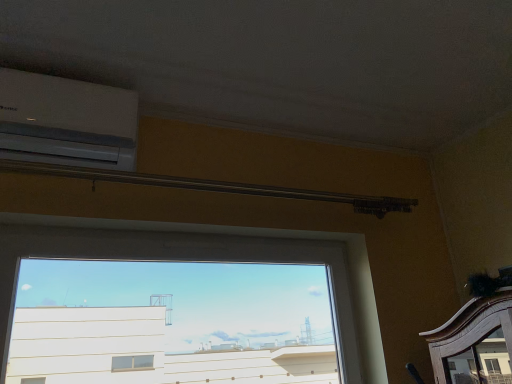
This screenshot has height=384, width=512. What do you see at coordinates (66, 121) in the screenshot? I see `white plastic air conditioner at upper left` at bounding box center [66, 121].

The width and height of the screenshot is (512, 384). I want to click on white plastic air conditioner at upper left, so click(x=66, y=121).

The height and width of the screenshot is (384, 512). I want to click on transparent glass window at center, so [x=215, y=260].

Image resolution: width=512 pixels, height=384 pixels. Describe the element at coordinates (215, 260) in the screenshot. I see `transparent glass window at center` at that location.

The width and height of the screenshot is (512, 384). What are the coordinates of `white plastic air conditioner at upper left` in the screenshot? It's located at (66, 121).

In the scene shown: Considering the positions of objects white plastic air conditioner at upper left and transparent glass window at center in the image provided, who is more to the left, white plastic air conditioner at upper left or transparent glass window at center?

white plastic air conditioner at upper left is more to the left.

Based on the photo, relative to transparent glass window at center, is white plastic air conditioner at upper left in front or behind?

white plastic air conditioner at upper left is positioned farther from the viewer than transparent glass window at center.

Looking at this image, which is less distant, (68, 156) or (69, 233)?

The point (68, 156) is in front.

From the image's perspective, is white plastic air conditioner at upper left above transparent glass window at center?

Indeed, from the image's perspective, white plastic air conditioner at upper left is shown above transparent glass window at center.

From a real-world perspective, which object rests below the other?

transparent glass window at center, from a real-world perspective.

Looking at their sizes, would you say white plastic air conditioner at upper left is wider or thinner than transparent glass window at center?

Clearly, white plastic air conditioner at upper left has more width compared to transparent glass window at center.

Is white plastic air conditioner at upper left shorter than transparent glass window at center?

Yes.

Considering the sizes of objects white plastic air conditioner at upper left and transparent glass window at center in the image provided, who is bigger, white plastic air conditioner at upper left or transparent glass window at center?

transparent glass window at center is bigger.

Is white plastic air conditioner at upper left inside or outside of transparent glass window at center?

white plastic air conditioner at upper left is spatially situated outside transparent glass window at center.

Consider the image. Is white plastic air conditioner at upper left in contact with transparent glass window at center?

white plastic air conditioner at upper left is not next to transparent glass window at center, and they're not touching.

Could you tell me if white plastic air conditioner at upper left is turned towards transparent glass window at center?

No, white plastic air conditioner at upper left is not facing towards transparent glass window at center.

Measure the distance from white plastic air conditioner at upper left to transparent glass window at center.

A distance of 42.40 centimeters exists between white plastic air conditioner at upper left and transparent glass window at center.

Find the location of a particular element. air conditioning on the left of transparent glass window at center is located at coordinates (66, 121).

Would you say transparent glass window at center is to the left or to the right of white plastic air conditioner at upper left in the picture?

Based on their positions, transparent glass window at center is located to the right of white plastic air conditioner at upper left.

In the image, is transparent glass window at center positioned in front of or behind white plastic air conditioner at upper left?

transparent glass window at center is positioned closer to the viewer than white plastic air conditioner at upper left.

Is point (66, 228) more distant than point (29, 103)?

Yes, point (66, 228) is farther from viewer.

From the image's perspective, which is below, transparent glass window at center or white plastic air conditioner at upper left?

transparent glass window at center appears lower in the image.

From a real-world perspective, is transparent glass window at center on white plastic air conditioner at upper left?

Actually, transparent glass window at center is physically below white plastic air conditioner at upper left in the real world.

Which of these two, transparent glass window at center or white plastic air conditioner at upper left, is wider?

Wider between the two is white plastic air conditioner at upper left.

Who is shorter, transparent glass window at center or white plastic air conditioner at upper left?

white plastic air conditioner at upper left is shorter.

In the scene shown: Between transparent glass window at center and white plastic air conditioner at upper left, which one has smaller size?

white plastic air conditioner at upper left is smaller.

Would you say white plastic air conditioner at upper left is part of transparent glass window at center's contents?

No.

Based on the photo, is there a large distance between transparent glass window at center and white plastic air conditioner at upper left?

transparent glass window at center is near white plastic air conditioner at upper left, not far away.

Does transparent glass window at center turn towards white plastic air conditioner at upper left?

No, transparent glass window at center is not facing towards white plastic air conditioner at upper left.

What's the angular difference between transparent glass window at center and white plastic air conditioner at upper left's facing directions?

0.633 degrees separate the facing orientations of transparent glass window at center and white plastic air conditioner at upper left.

At what (x,y) coordinates should I click in order to perform the action: click on air conditioning lying on the left of transparent glass window at center. Please return your answer as a coordinate pair (x, y). Looking at the image, I should click on (66, 121).

At what (x,y) coordinates should I click in order to perform the action: click on air conditioning above the transparent glass window at center (from the image's perspective). Please return your answer as a coordinate pair (x, y). Image resolution: width=512 pixels, height=384 pixels. Looking at the image, I should click on (66, 121).

Where is `window in front of the white plastic air conditioner at upper left`? window in front of the white plastic air conditioner at upper left is located at coordinates (215, 260).